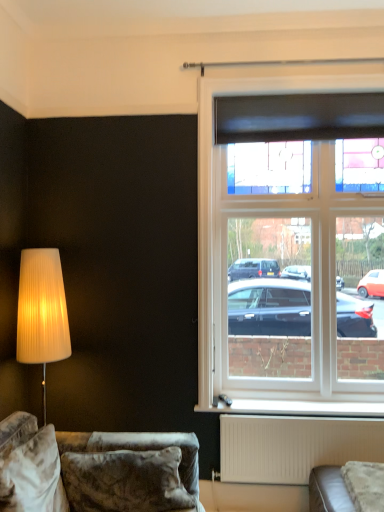
Question: Does point (324, 444) appear closer or farther from the camera than point (205, 354)?

Choices:
 (A) closer
 (B) farther

Answer: (A)

Question: Considering their positions, is white matte radiator at lower center located in front of or behind stained glass window at upper right?

Choices:
 (A) behind
 (B) front

Answer: (B)

Question: Estimate the real-world distances between objects in this image. Which object is closer to the black matte curtain at upper right?

Choices:
 (A) stained glass window at upper right
 (B) white matte radiator at lower center
 (C) velvet couch at lower left
 (D) white plastic window sill at lower center

Answer: (A)

Question: Estimate the real-world distances between objects in this image. Which object is farther from the white plastic window sill at lower center?

Choices:
 (A) stained glass window at upper right
 (B) black matte curtain at upper right
 (C) white matte radiator at lower center
 (D) velvet couch at lower left

Answer: (B)